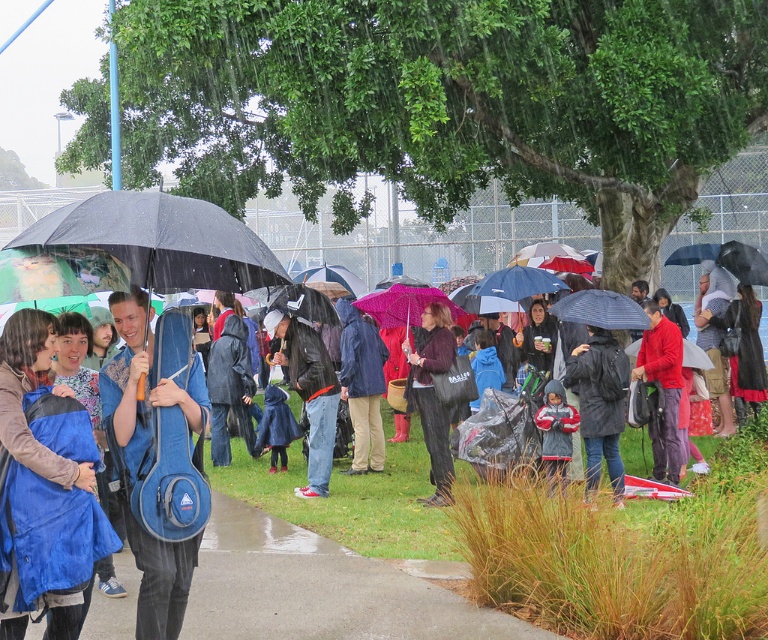
You are a photographer standing in the scene and want to take a photo that includes both the dark gray matte jacket at center and the velvet purple sweater at center. Which one will appear larger in the photo?

The dark gray matte jacket at center will appear larger in the photo because it is closer to the viewer than the velvet purple sweater at center.

You are standing at the origin point in the scene. There are two points marked in the image, point 1 at coordinates point (565, 364) and point 2 at coordinates point (432, 326). Which point is closer to you?

Point 2 at coordinates point (432, 326) is closer to you because it is in front of point 1 at coordinates point (565, 364).